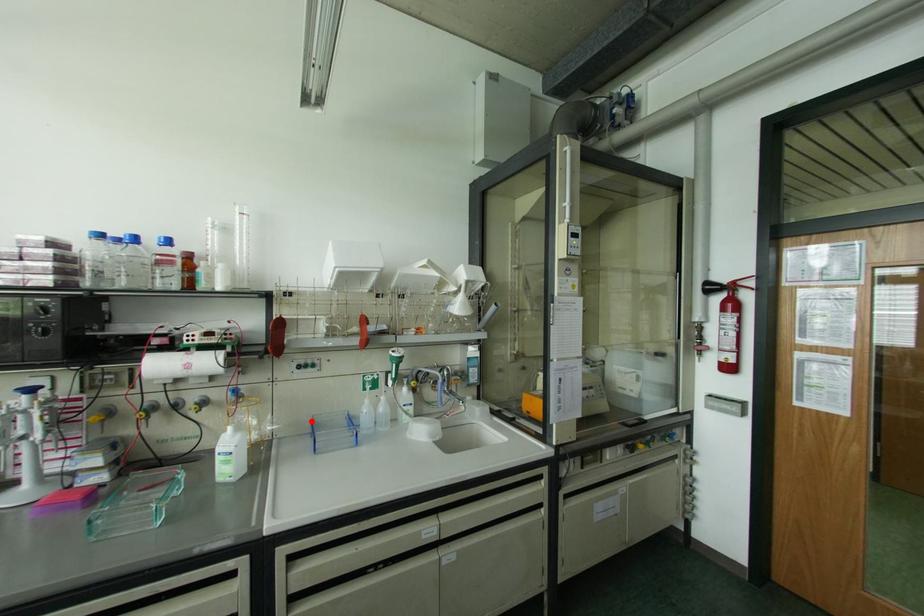
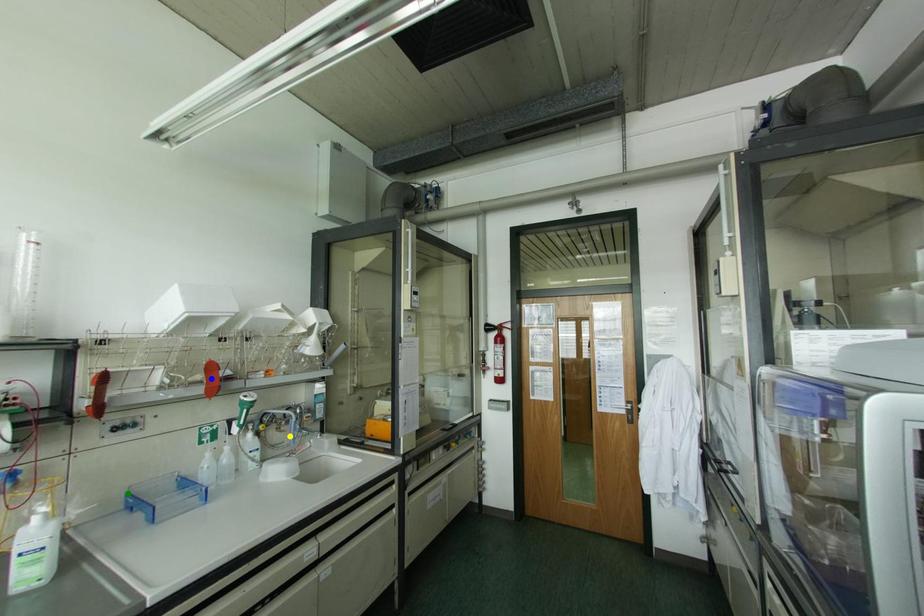
Question: I am providing you with two images of the same scene from different viewpoints. A red point is marked on the first image. You are given multiple points on the second image. Which mark in image 2 goes with the point in image 1?

Choices:
 (A) yellow point
 (B) green point
 (C) blue point

Answer: (B)